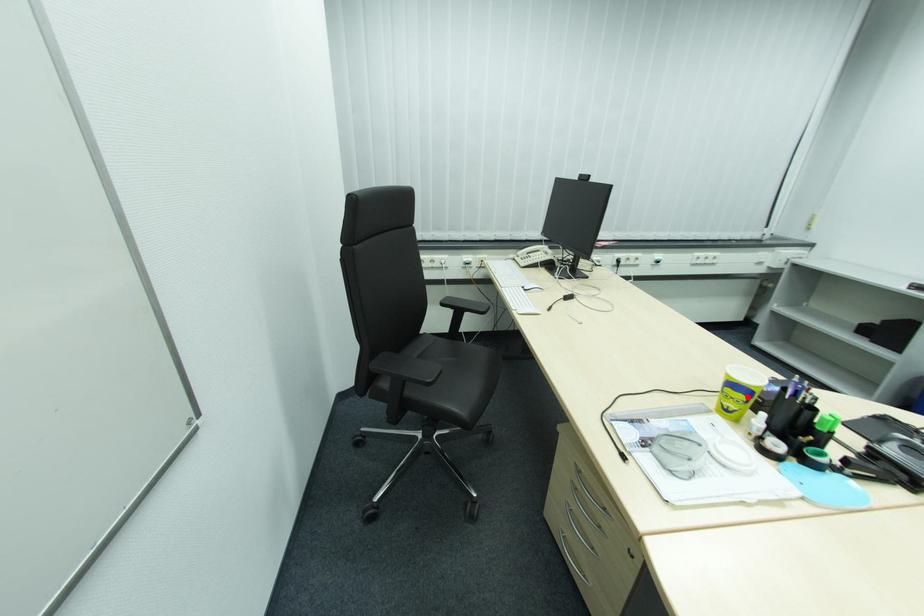
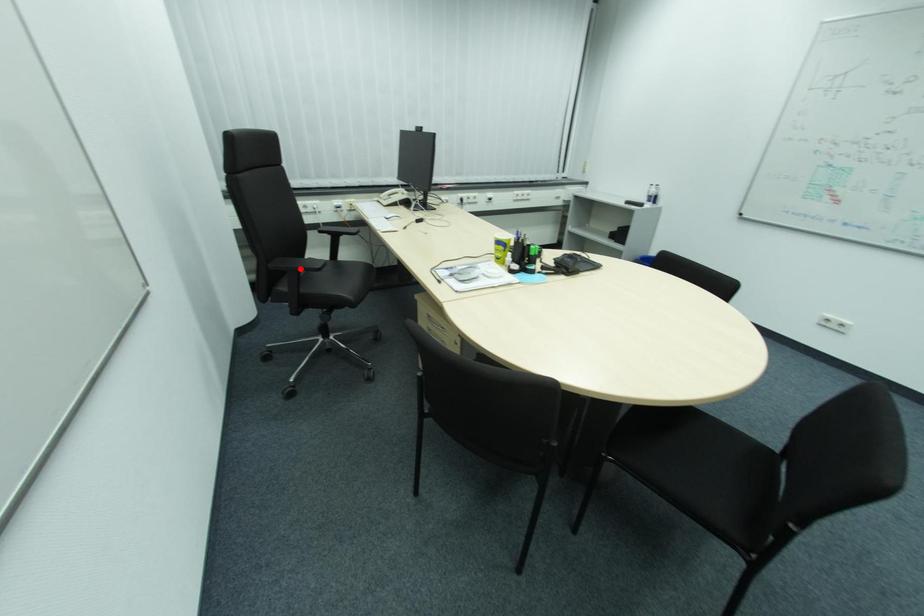
I am providing you with two images of the same scene from different viewpoints. A red point is marked on the first image and another point is marked on the second image. Are the points marked in image1 and image2 representing the same 3D position?

No